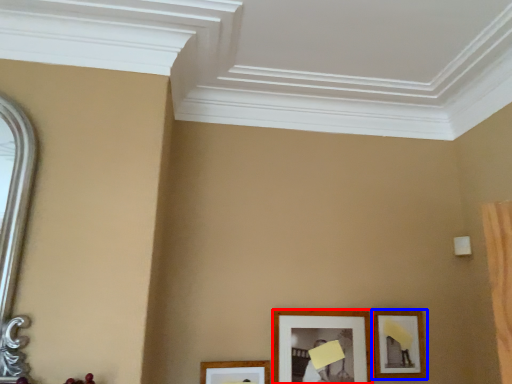
Question: Which object appears farthest to the camera in this image, picture frame (highlighted by a red box) or picture frame (highlighted by a blue box)?

Choices:
 (A) picture frame
 (B) picture frame

Answer: (B)